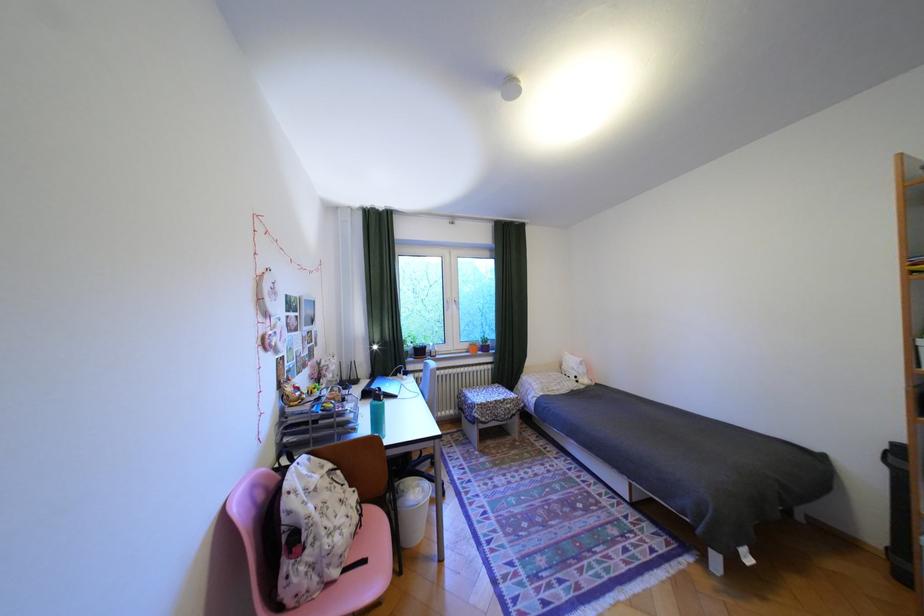
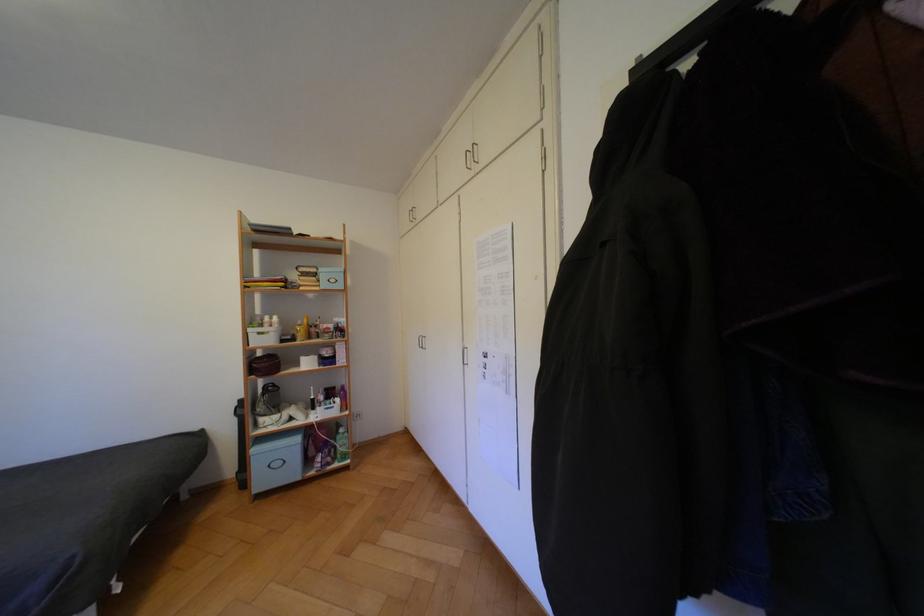
Question: Based on the continuous images, in which direction is the camera rotating? Reply with the corresponding letter.

Choices:
 (A) Left
 (B) Right
 (C) Up
 (D) Down

Answer: (B)